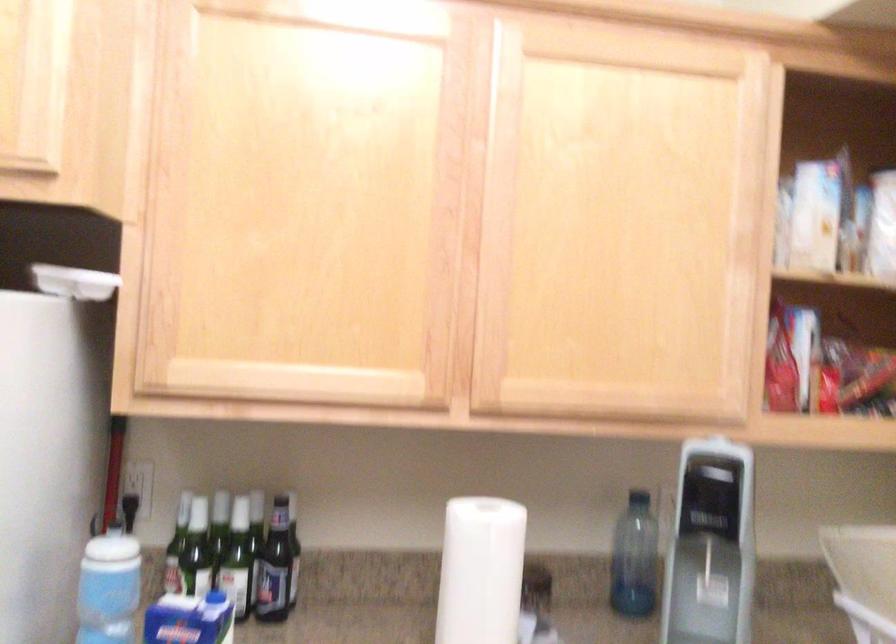
How did the camera likely rotate?

The camera's rotation is toward left-down.